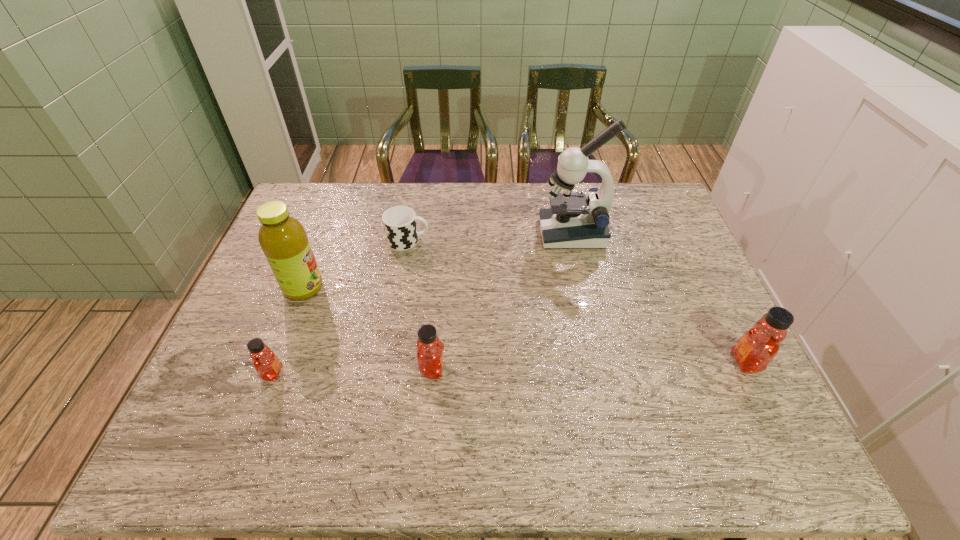
Locate an element on the screen. Image resolution: width=960 pixels, height=540 pixels. unoccupied position between the third object from left to right and the rightmost object is located at coordinates point(577,301).

Identify the location of object that is the closest one to the rightmost object. Image resolution: width=960 pixels, height=540 pixels. (573, 221).

This screenshot has width=960, height=540. Identify the location of the fourth closest object to the cup. (266, 363).

I want to click on honey that is the third closest to the tallest object, so click(x=266, y=363).

Find the location of a particular element. the second closest honey relative to the third farthest object is located at coordinates (430, 359).